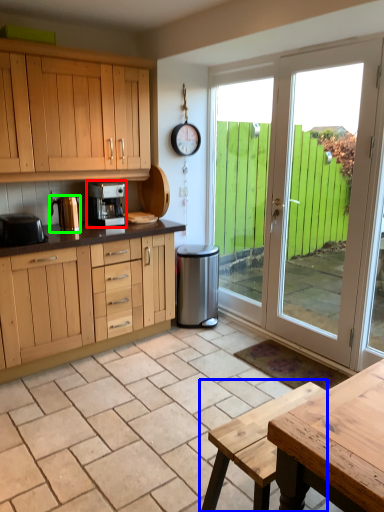
Question: Which object is the closest to the kitchen appliance (highlighted by a red box)? Choose among these: picnic table (highlighted by a blue box) or appliance (highlighted by a green box).

Choices:
 (A) picnic table
 (B) appliance

Answer: (B)